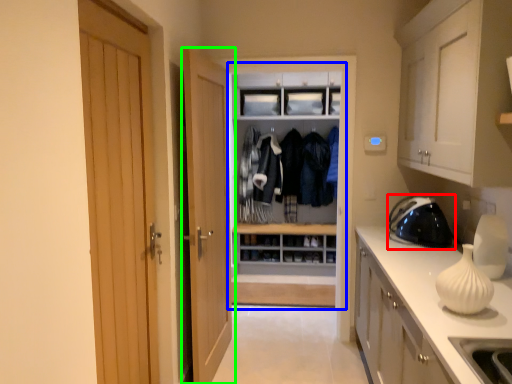
Question: Considering the real-world distances, which object is closest to appliance (highlighted by a red box)? dresser (highlighted by a blue box) or door (highlighted by a green box).

Choices:
 (A) dresser
 (B) door

Answer: (A)